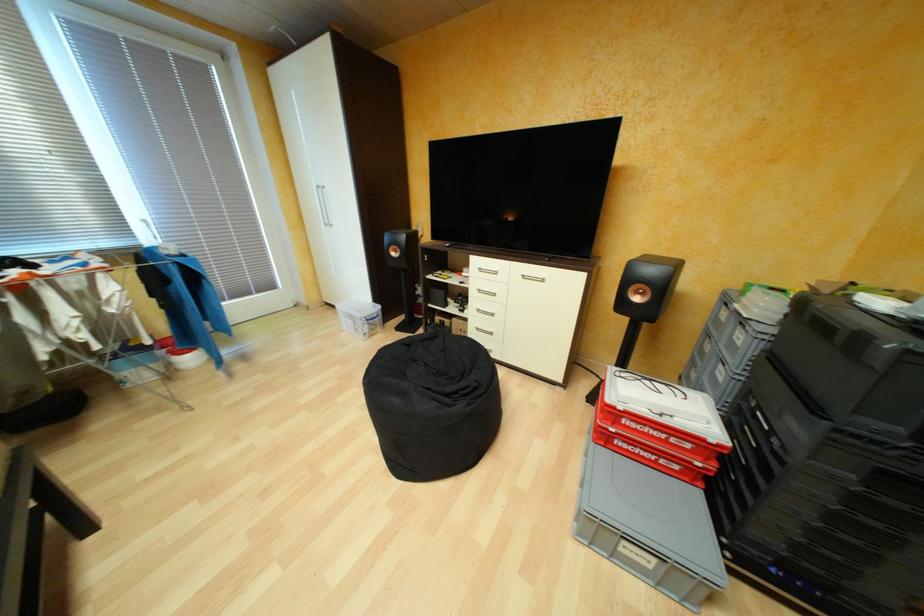
Where would you lift the clear plastic box? Please return your answer as a coordinate pair (x, y).

(649, 525)